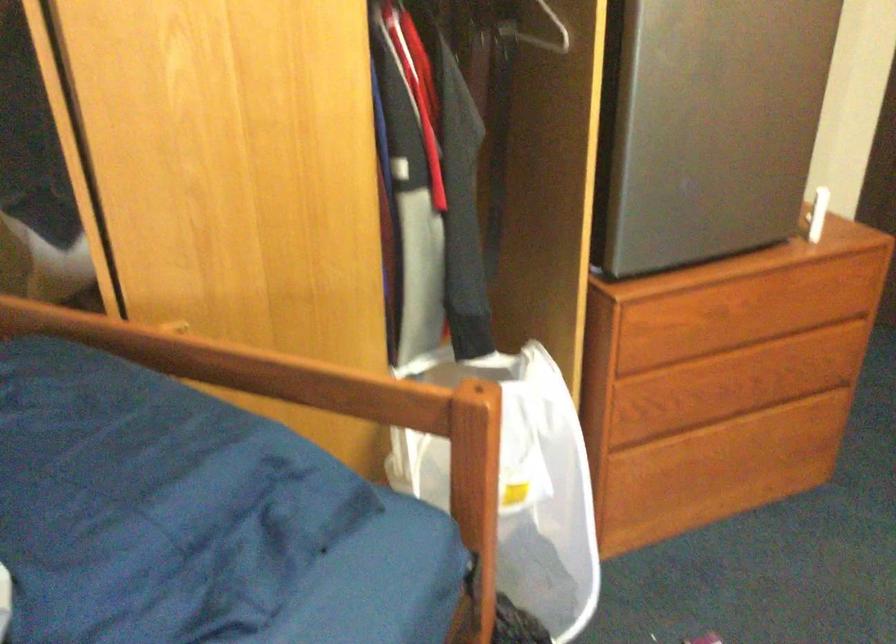
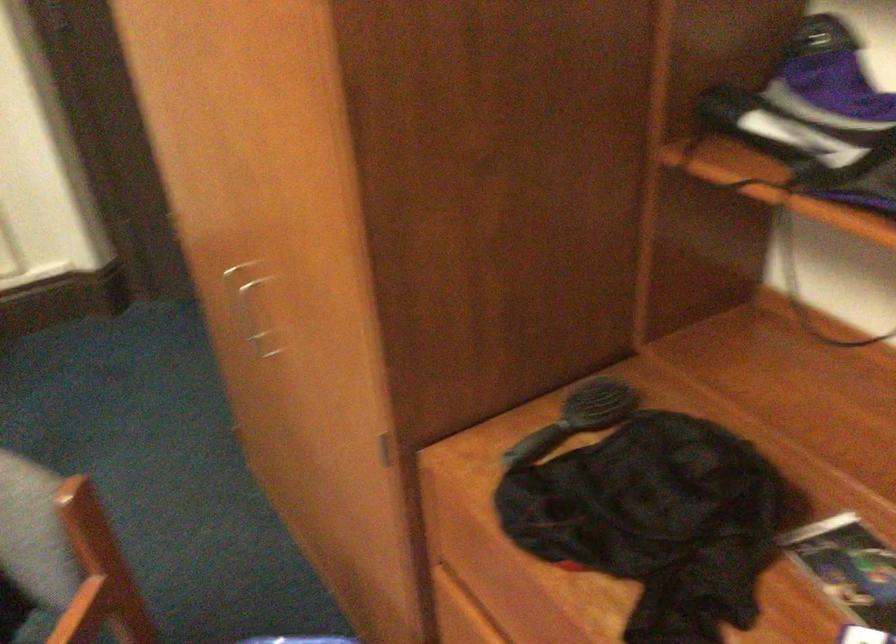
Question: The images are taken continuously from a first-person perspective. In which direction are you moving?

Choices:
 (A) Left
 (B) Right
 (C) Forward
 (D) Backward

Answer: (B)